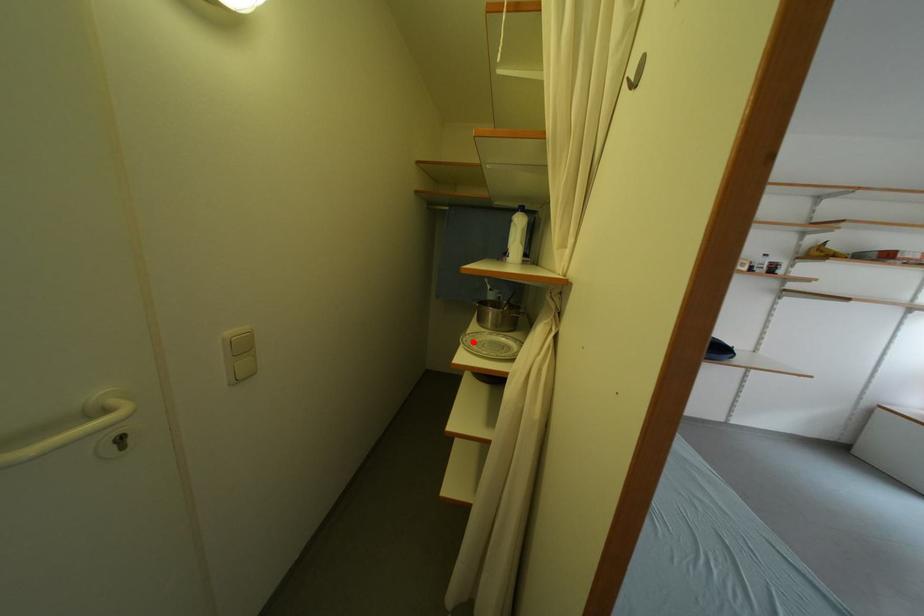
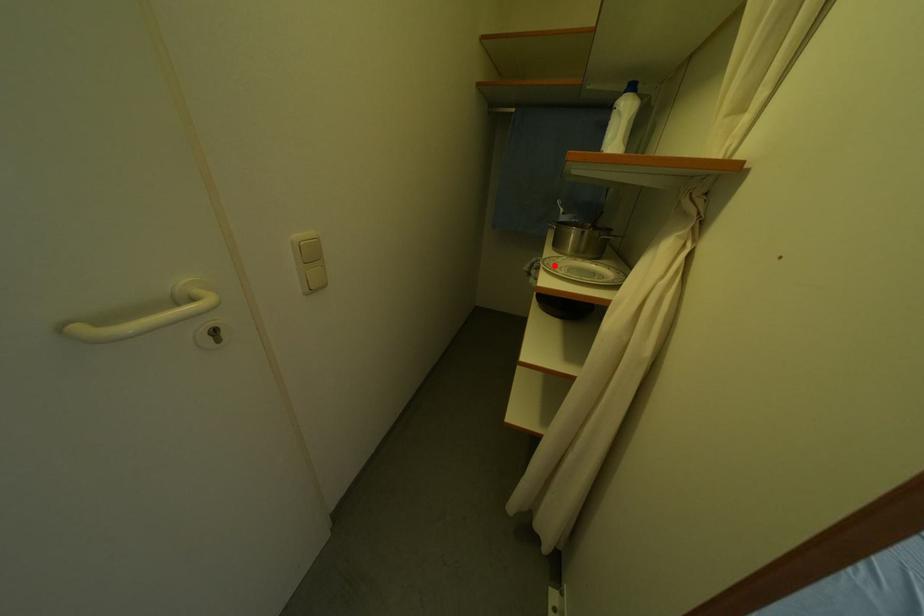
I am providing you with two images of the same scene from different viewpoints. A red point is marked on the first image and another point is marked on the second image. Do the highlighted points in image1 and image2 indicate the same real-world spot?

Yes